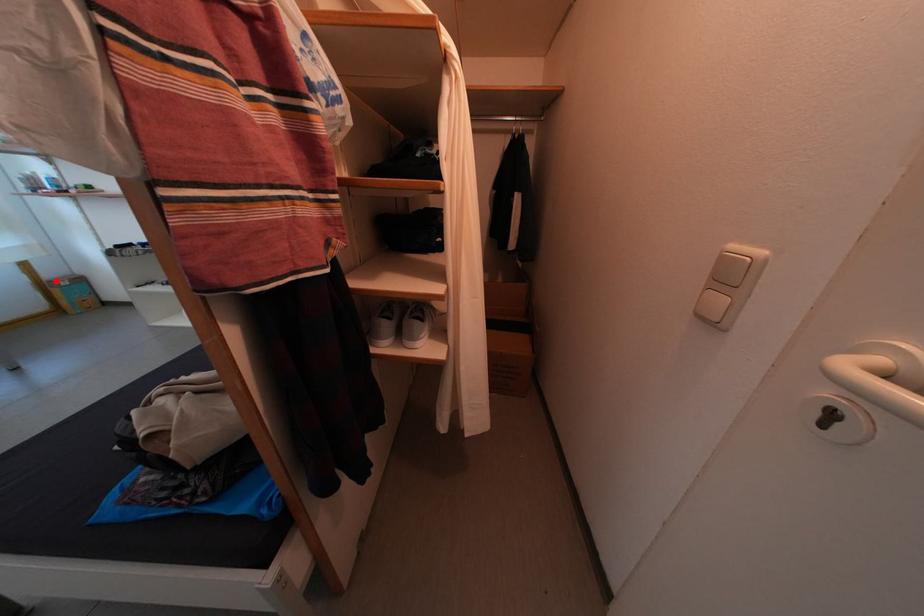
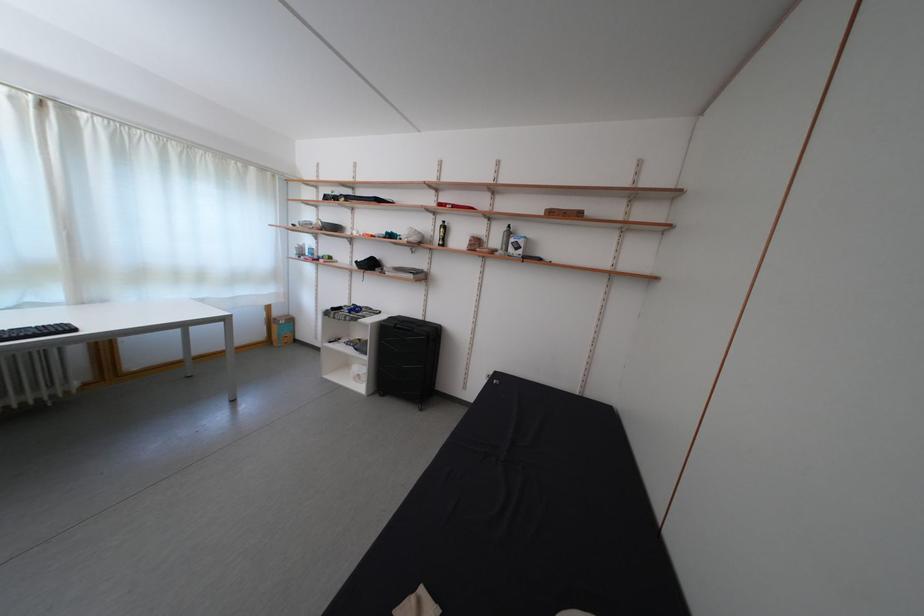
Question: I am providing you with two images of the same scene from different viewpoints. In image1, a red point is highlighted. Considering the same 3D point in image2, which of the following is correct?

Choices:
 (A) It is closer
 (B) It is farther

Answer: (A)